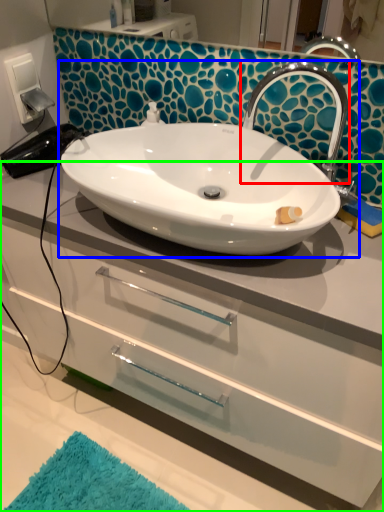
Question: Based on their relative distances, which object is farther from tap (highlighted by a red box)? Choose from sink (highlighted by a blue box) and bathroom cabinet (highlighted by a green box).

Choices:
 (A) sink
 (B) bathroom cabinet

Answer: (B)